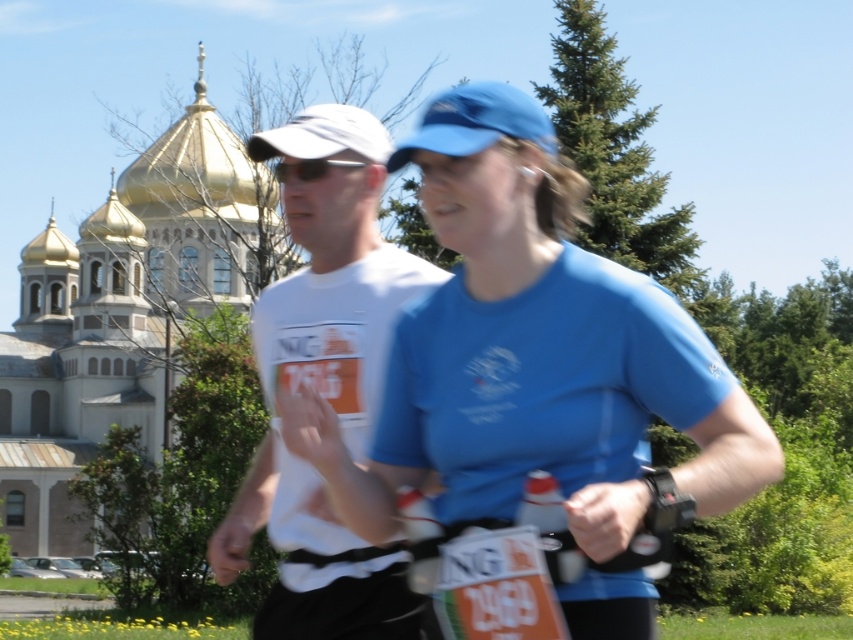
You are a photographer positioned at the center of the scene. You want to take a photo of both the blue fabric shirt at center and the black plastic sunglasses at center. The camera has a maximum focus range of 30 feet. Will both subjects be in focus?

The blue fabric shirt at center is 32.83 feet from the black plastic sunglasses at center. Since the maximum focus range is 30 feet, the distance between them exceeds this limit, so both subjects cannot be in focus simultaneously.

You are a race official at the running event. You need to determine the order of the two runners based on their positions. The first runner is at point (573,499) and the second runner is at point (316,172). According to the race rules, the runner who is closer to the finish line wins. Which runner is in the lead?

Point (573,499) is in front of point (316,172), so the runner at point (573,499) is in the lead.